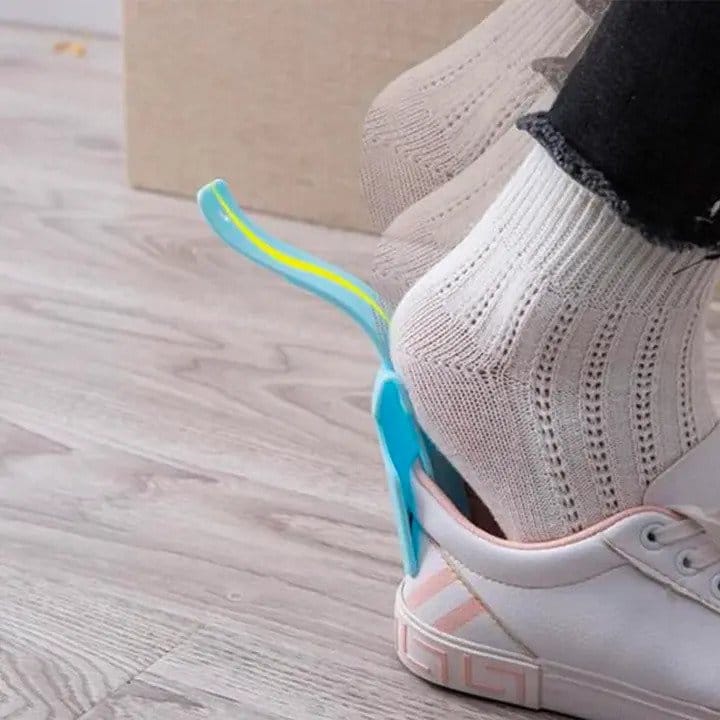
Find the location of a particular element. grain lines in wood floor is located at coordinates coord(86,672), coord(284,359).